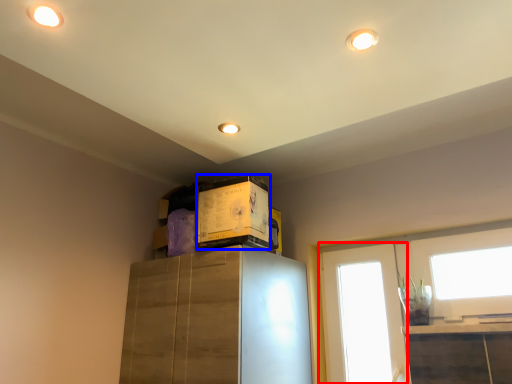
Question: Which object is further to the camera taking this photo, window (highlighted by a red box) or box (highlighted by a blue box)?

Choices:
 (A) window
 (B) box

Answer: (A)